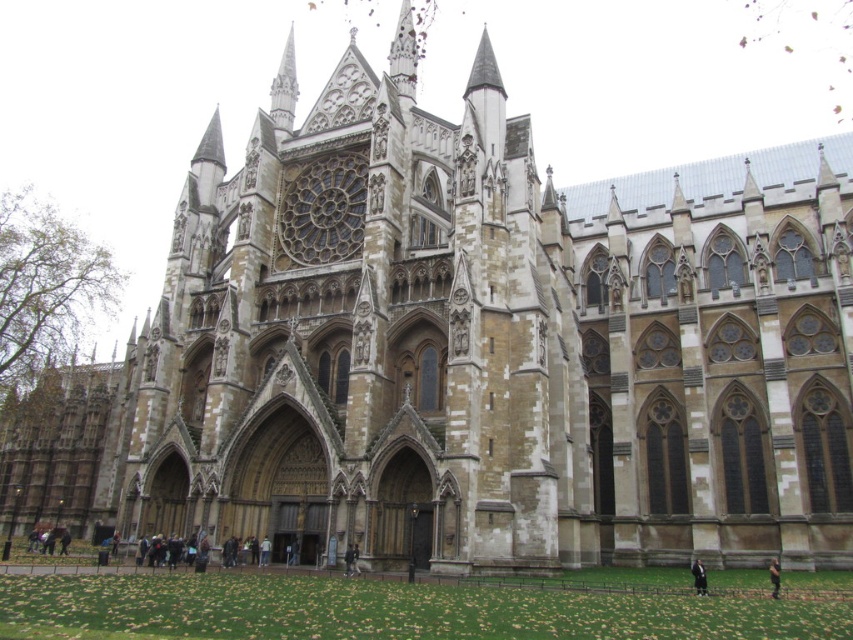
You are standing at the entrance of Westminster Abbey and see both the dark gray wool coat at lower right and the dark brown leather jacket at lower right. Which one is closer to you?

The dark gray wool coat at lower right is 5.11 meters away from the dark brown leather jacket at lower right, so the dark brown leather jacket at lower right is closer to you since it is positioned farther away than the dark gray wool coat at lower right.

You are standing in front of Westminster Abbey and notice two items at the lower right of the scene. Which item is positioned lower between the dark gray wool coat at lower right and the dark brown leather jacket at lower right?

The dark gray wool coat at lower right is positioned below the dark brown leather jacket at lower right, so it is the lower one.

You are a tourist visiting Westminster Abbey and notice two items at the lower right of the scene. Which one is closer to you between the dark gray wool coat at lower right and the dark brown leather jacket at lower right?

The dark gray wool coat at lower right is closer to you because the dark brown leather jacket at lower right is positioned behind it.